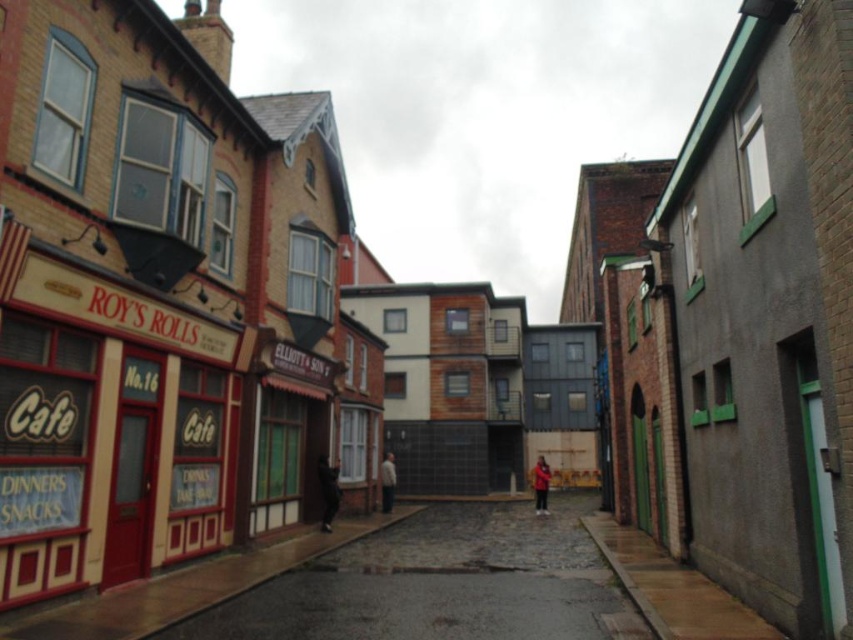
This screenshot has width=853, height=640. Describe the element at coordinates (328, 492) in the screenshot. I see `dark gray fabric jacket at center` at that location.

Where is `dark gray fabric jacket at center`? Image resolution: width=853 pixels, height=640 pixels. dark gray fabric jacket at center is located at coordinates (328, 492).

Is point (332, 476) in front of point (543, 497)?

Yes, it is in front of point (543, 497).

This screenshot has height=640, width=853. In order to click on dark gray fabric jacket at center in this screenshot , I will do `click(328, 492)`.

Can you confirm if red fabric coat at center is bigger than white matte jacket at center?

Correct, red fabric coat at center is larger in size than white matte jacket at center.

Where is `red fabric coat at center`? This screenshot has height=640, width=853. red fabric coat at center is located at coordinates (540, 484).

Locate an element on the screen. The height and width of the screenshot is (640, 853). red fabric coat at center is located at coordinates (540, 484).

Where is `dark gray fabric jacket at center`? The width and height of the screenshot is (853, 640). dark gray fabric jacket at center is located at coordinates (328, 492).

Is dark gray fabric jacket at center to the left of white matte jacket at center from the viewer's perspective?

Yes, dark gray fabric jacket at center is to the left of white matte jacket at center.

This screenshot has height=640, width=853. What do you see at coordinates (328, 492) in the screenshot?
I see `dark gray fabric jacket at center` at bounding box center [328, 492].

The width and height of the screenshot is (853, 640). What are the coordinates of `dark gray fabric jacket at center` in the screenshot? It's located at (328, 492).